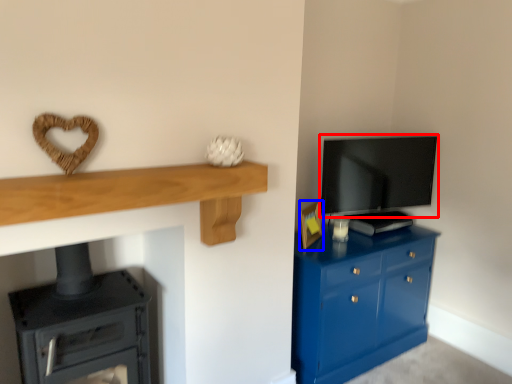
Question: Which object is closer to the camera taking this photo, television (highlighted by a red box) or picture frame (highlighted by a blue box)?

Choices:
 (A) television
 (B) picture frame

Answer: (B)